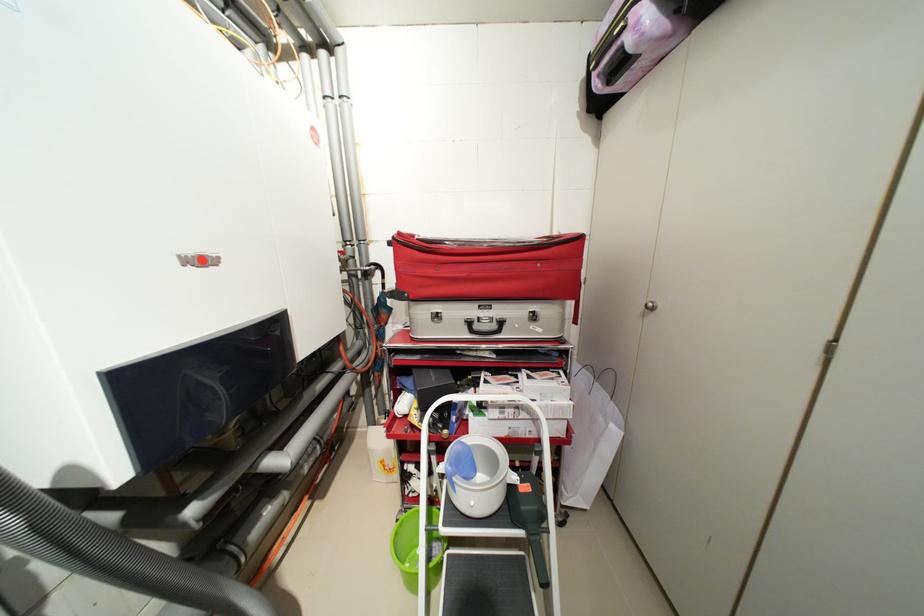
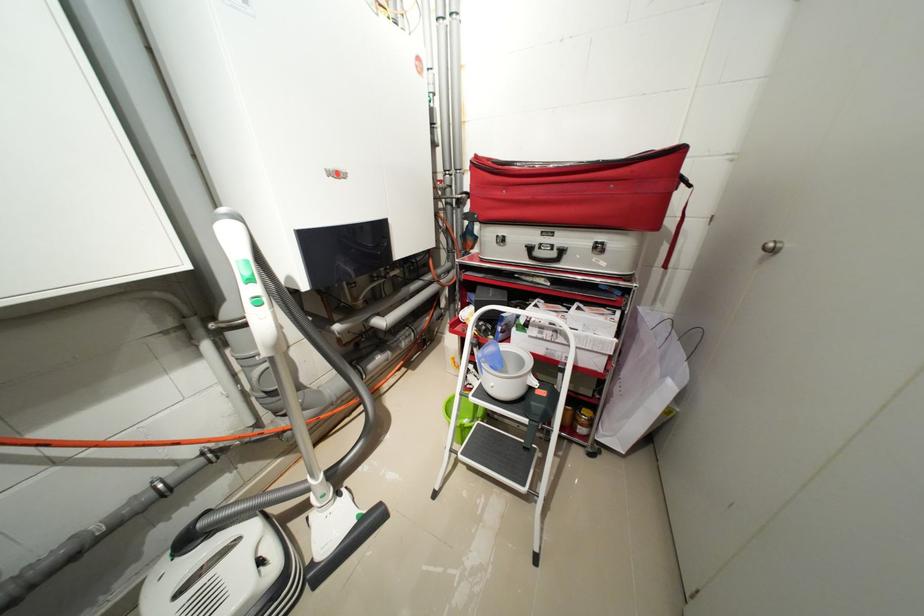
Which direction would the cameraman need to move to produce the second image?

The cameraman walked toward right, backward.